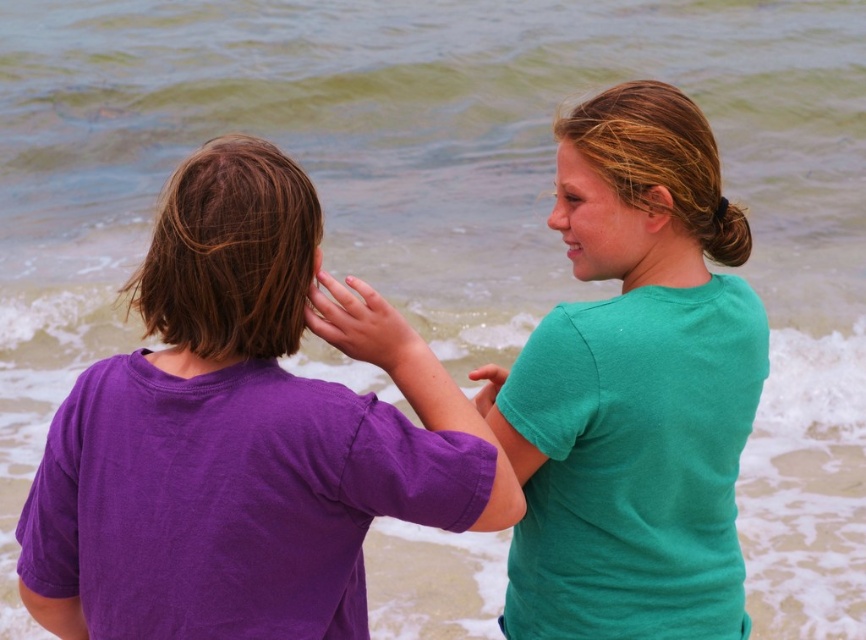
Question: Among these points, which one is nearest to the camera?

Choices:
 (A) (587, 474)
 (B) (308, 296)

Answer: (B)

Question: Is matte skin hand at center in front of matte green shirt at upper right?

Choices:
 (A) no
 (B) yes

Answer: (B)

Question: Can you confirm if purple cotton shirt at left is positioned below matte green shirt at upper right?

Choices:
 (A) yes
 (B) no

Answer: (A)

Question: Which is farther from the green matte shirt at upper right?

Choices:
 (A) matte green shirt at upper right
 (B) matte skin hand at center

Answer: (B)

Question: Is purple cotton shirt at left to the right of matte green shirt at upper right from the viewer's perspective?

Choices:
 (A) no
 (B) yes

Answer: (A)

Question: Which point is closer to the camera taking this photo?

Choices:
 (A) (369, 285)
 (B) (480, 412)
 (C) (405, 442)
 (D) (558, 512)

Answer: (C)